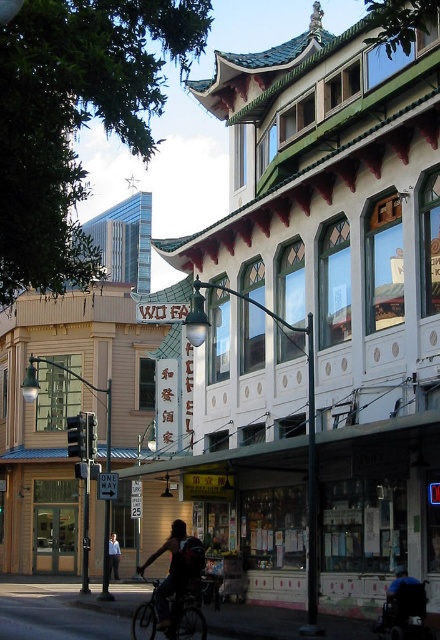
You are a delivery person standing on the street in the Chinatown district. You need to pick up a package from the shiny metallic bicycle at center and deliver it to the person wearing the dark blue shirt at center. Can you directly hand the package to them without moving the bicycle or the shirt?

The shiny metallic bicycle at center is located above the dark blue shirt at center, so you can directly hand the package to them since the bicycle is positioned above the shirt.

You are a delivery person who needs to pick up a package from the store. You see a shiny metallic bicycle at center and a dark blue shirt at center. Which object is taller?

The shiny metallic bicycle at center is taller than the dark blue shirt at center according to the description.

You are a tourist standing on the street in front of the building with the tiered roof. You see a shiny metallic bicycle at center and a dark blue shirt at center. Which object is closer to you?

The shiny metallic bicycle at center is closer to the viewer than the dark blue shirt at center.